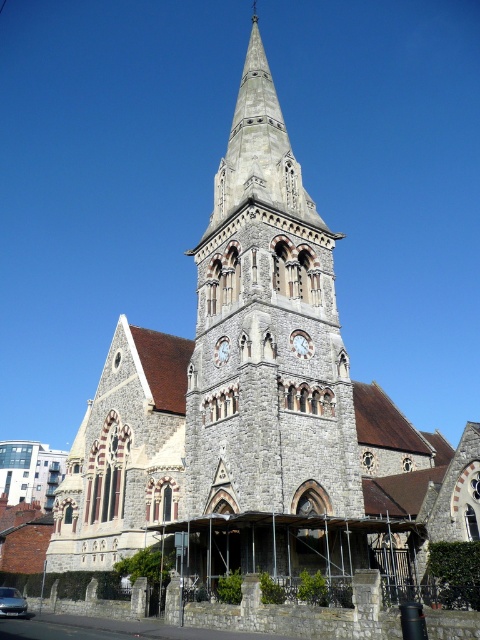
Question: Which point is farther to the camera?

Choices:
 (A) (224, 362)
 (B) (300, 356)

Answer: (A)

Question: Which of the following is the farthest from the observer?

Choices:
 (A) white marble clock at center
 (B) gray stone tower at center
 (C) light gray stone clock at center

Answer: (C)

Question: Does gray stone tower at center appear on the right side of light gray stone clock at center?

Choices:
 (A) yes
 (B) no

Answer: (A)

Question: Does gray stone tower at center have a greater width compared to light gray stone clock at center?

Choices:
 (A) no
 (B) yes

Answer: (B)

Question: Which point appears closest to the camera in this image?

Choices:
 (A) (230, 432)
 (B) (300, 356)

Answer: (A)

Question: Can you confirm if gray stone tower at center is bigger than white marble clock at center?

Choices:
 (A) no
 (B) yes

Answer: (B)